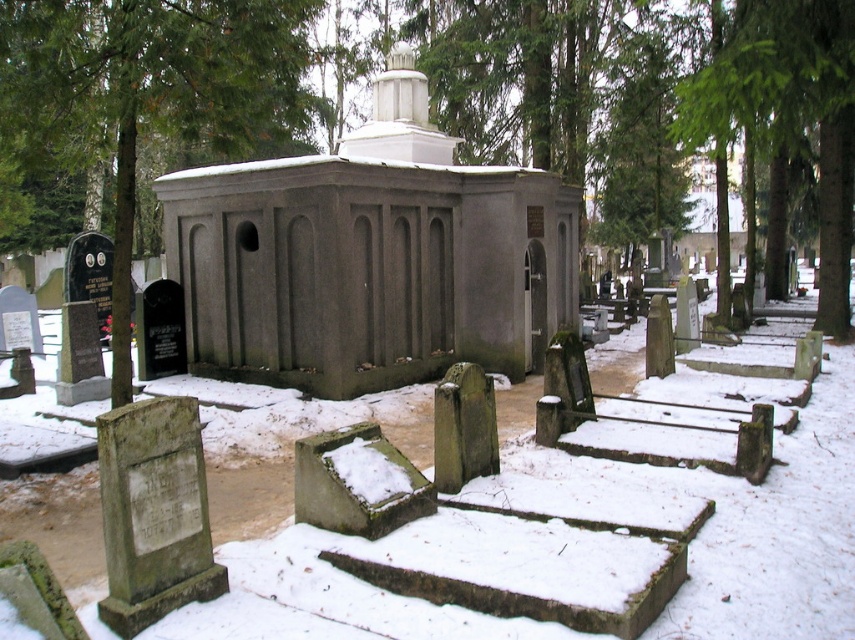
Question: Does green textured tree at left have a larger size compared to green textured tree at center?

Choices:
 (A) no
 (B) yes

Answer: (B)

Question: Among these objects, which one is nearest to the camera?

Choices:
 (A) green textured tree at center
 (B) green textured tree at left
 (C) gray concrete church at center

Answer: (B)

Question: Based on their relative distances, which object is farther from the green textured tree at center?

Choices:
 (A) green textured tree at left
 (B) gray concrete church at center

Answer: (B)

Question: Based on their relative distances, which object is nearer to the green textured tree at left?

Choices:
 (A) green textured tree at center
 (B) gray concrete church at center

Answer: (B)

Question: Considering the relative positions of gray concrete church at center and green textured tree at left in the image provided, where is gray concrete church at center located with respect to green textured tree at left?

Choices:
 (A) below
 (B) above

Answer: (A)

Question: Is green textured tree at left further to camera compared to green textured tree at center?

Choices:
 (A) no
 (B) yes

Answer: (A)